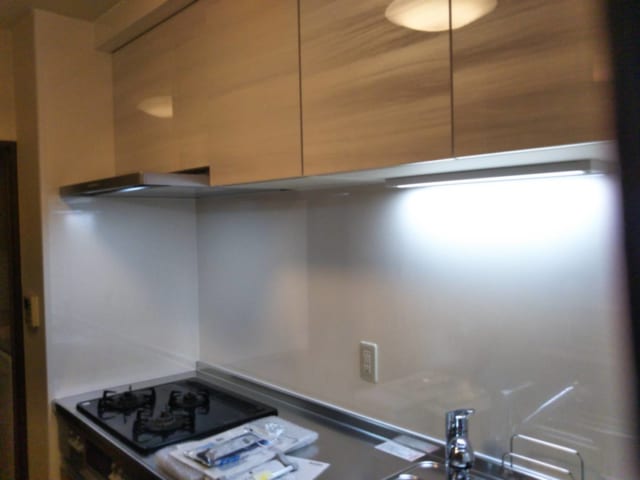
Locate an element on the screen. The image size is (640, 480). wall is located at coordinates (429, 341).